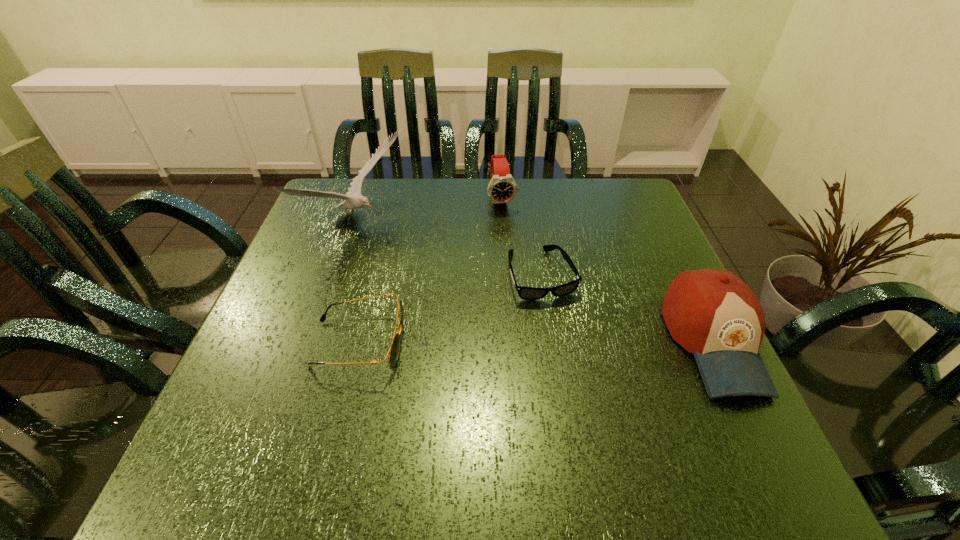
The image size is (960, 540). Identify the location of the left sunglasses. (394, 350).

Where is `the nearer sunglasses`? the nearer sunglasses is located at coordinates (394, 350).

This screenshot has height=540, width=960. Identify the location of baseball cap. tap(713, 314).

Locate an element on the screen. This screenshot has height=540, width=960. watch is located at coordinates (502, 188).

I want to click on the shorter sunglasses, so click(x=526, y=293).

This screenshot has width=960, height=540. Identify the location of the right sunglasses. click(x=526, y=293).

Where is `gull`? gull is located at coordinates (353, 198).

Identify the location of free location located on the front-facing side of the nearer sunglasses. (536, 343).

This screenshot has height=540, width=960. Identify the location of vacant position located on the face of the watch. (510, 233).

Find the location of a particular element. free region located on the face of the watch is located at coordinates (518, 264).